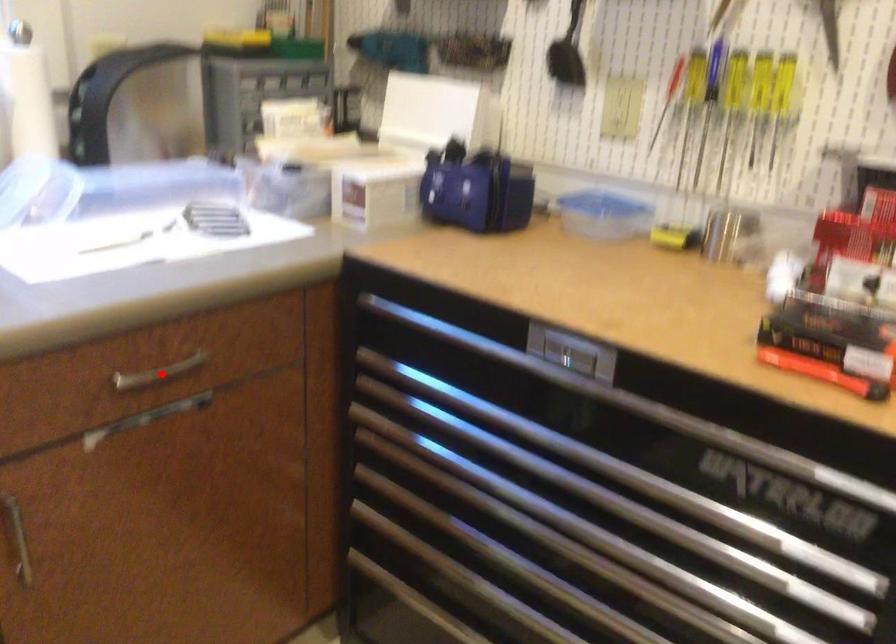
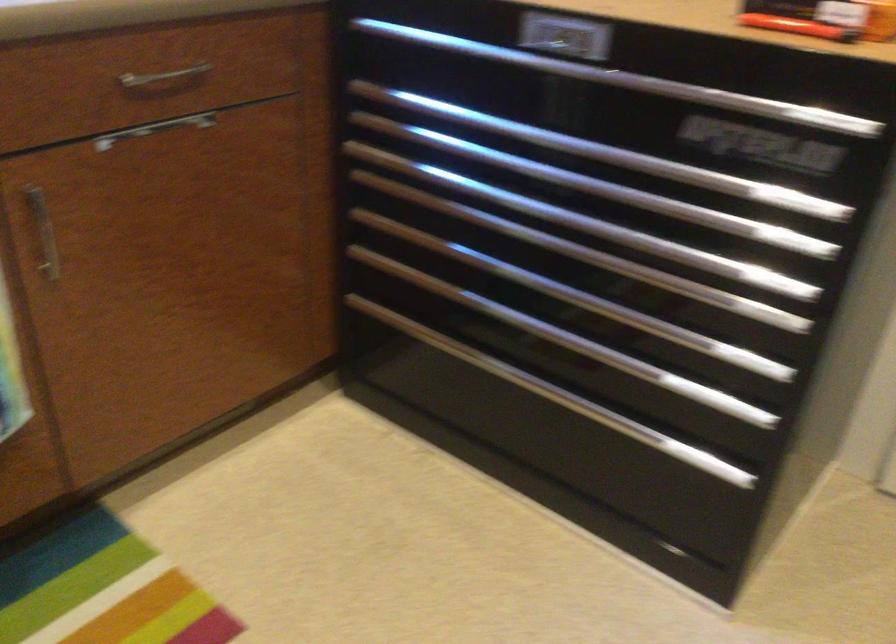
Where in the second image is the point corresponding to the highlighted location from the first image?

(164, 78)